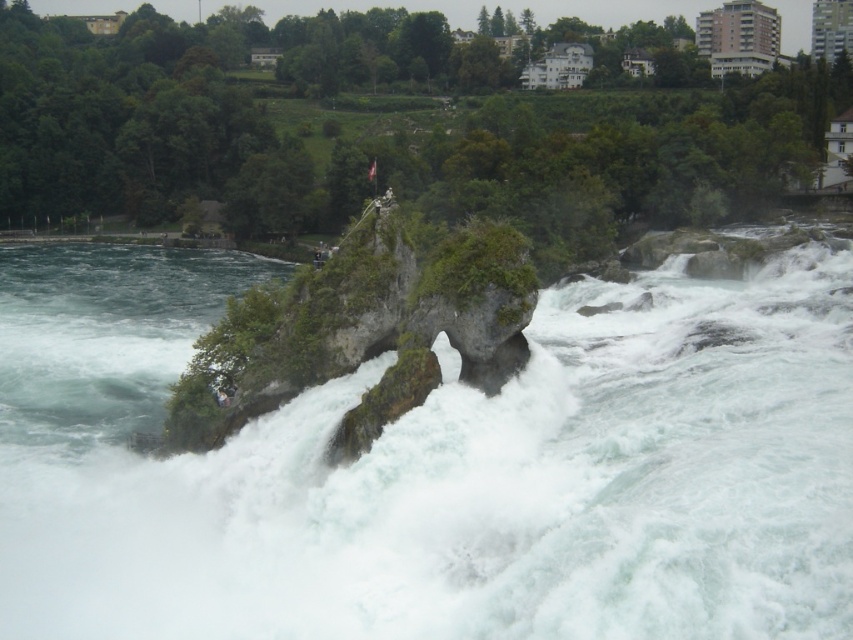
You are standing at the base of the waterfall and want to determine which of the two points, point (498, 442) or point (463, 346), is nearer to you. Based on the scene description, which point is closer?

Point (498, 442) is closer to the viewer than point (463, 346).

You are standing at a point where you can see the waterfall and the buildings in the background. You want to take a photo that includes both the waterfall and the buildings. Is the point at coordinates point (115, 621) in the frame? Please explain your reasoning.

The point at coordinates point (115, 621) is 28.82 meters away from the camera. Since the buildings are in the background beyond the waterfall, the point is likely within the frame as it is positioned at a moderate distance, allowing both the waterfall and buildings to be captured in the same shot.

You are standing at the edge of the waterfall and see the white frothy water at center and the green mossy rock at center. Which object is closer to you?

The white frothy water at center is closer to you because it is in front of the green mossy rock at center.